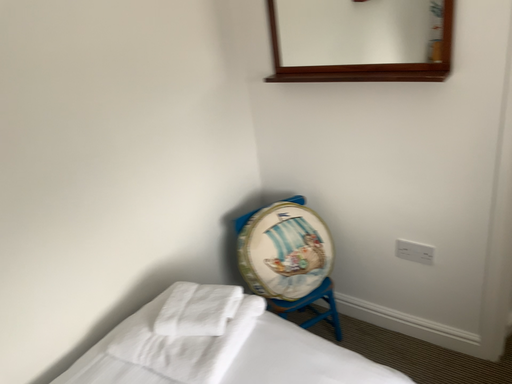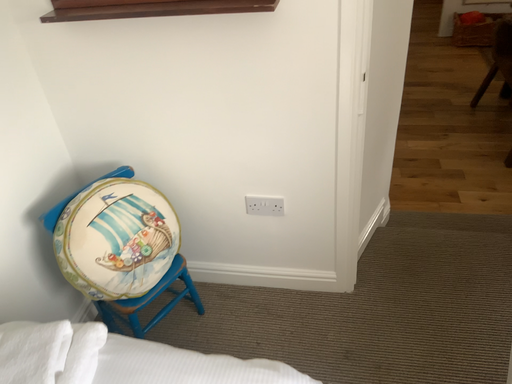
Question: How did the camera likely rotate when shooting the video?

Choices:
 (A) rotated downward
 (B) rotated upward

Answer: (A)